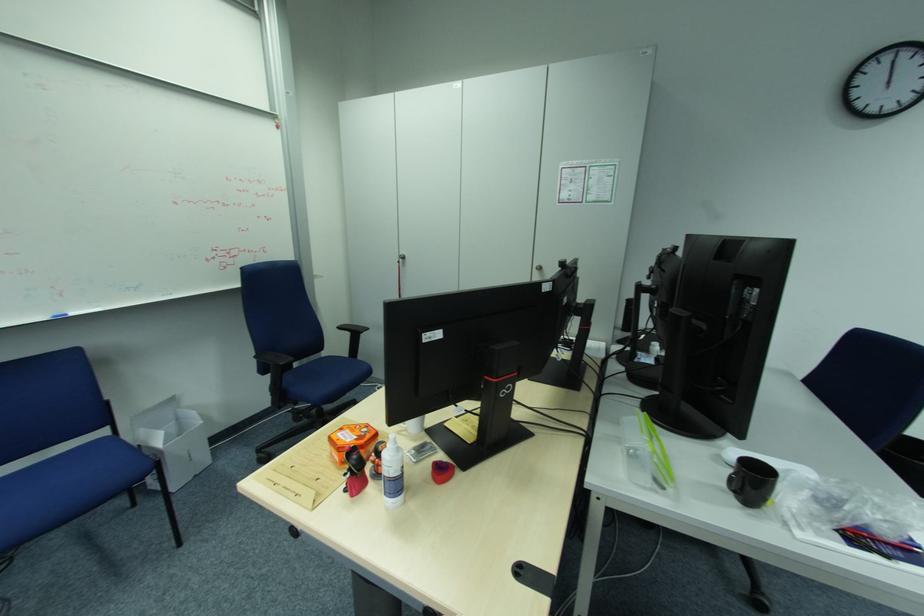
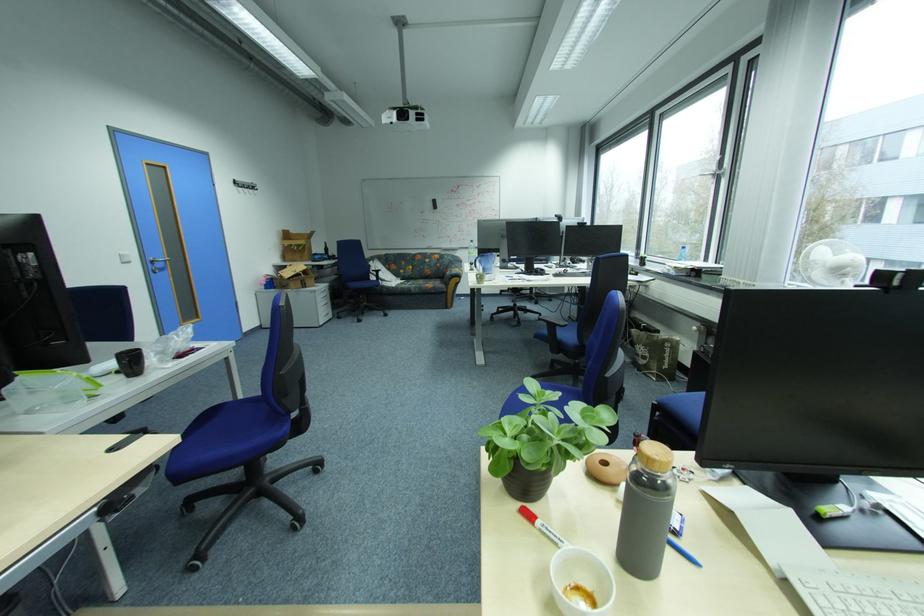
The images are taken continuously from a first-person perspective. In which direction is your viewpoint rotating?

The camera's rotation is toward right-down.